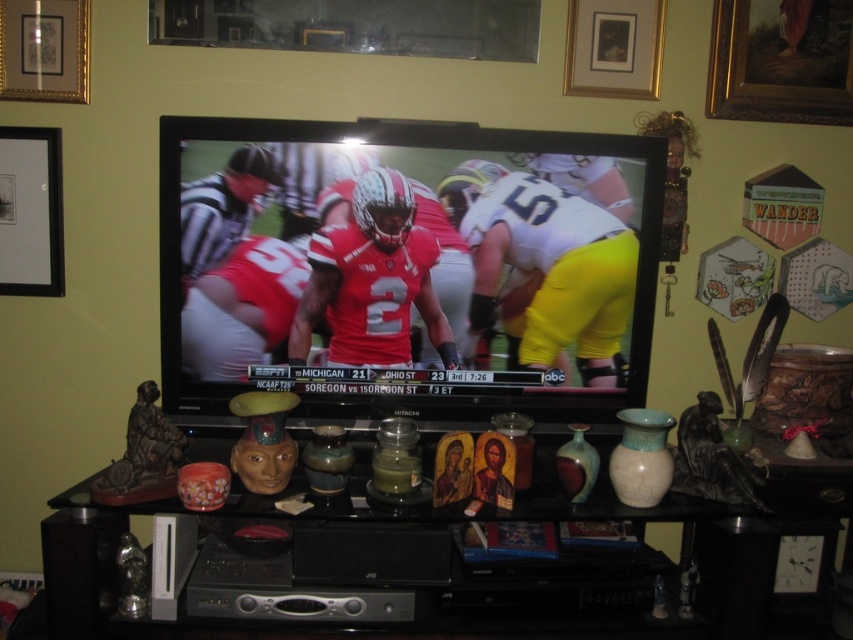
Does matte ceramic vase at center lie behind black matte picture frame at upper left?

No, it is in front of black matte picture frame at upper left.

Does point (222, 538) come behind point (10, 269)?

No, (222, 538) is in front of (10, 269).

Does point (664, 620) lie in front of point (44, 134)?

Yes, point (664, 620) is in front of point (44, 134).

In order to click on matte ceramic vase at center in this screenshot , I will do `click(407, 566)`.

Between matte black television at center and goldframed painting at upper right, which one is positioned lower?

matte black television at center is below.

This screenshot has height=640, width=853. Identify the location of matte black television at center. (416, 264).

Can you confirm if matte ceramic vase at center is positioned below gold-framed picture at upper center?

Correct, matte ceramic vase at center is located below gold-framed picture at upper center.

Can you confirm if matte ceramic vase at center is wider than gold-framed picture at upper center?

Correct, the width of matte ceramic vase at center exceeds that of gold-framed picture at upper center.

The height and width of the screenshot is (640, 853). Identify the location of matte ceramic vase at center. (407, 566).